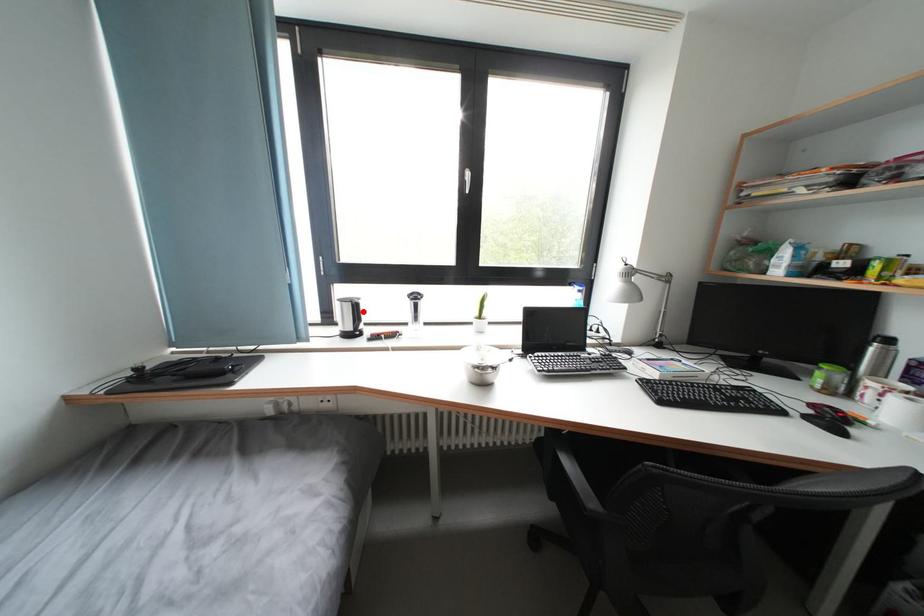
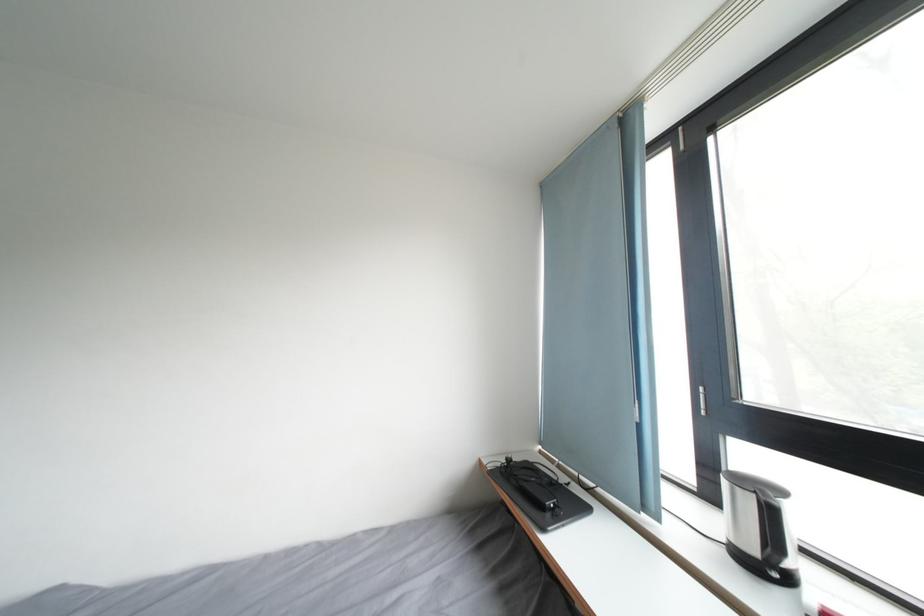
Question: I am providing you with two images of the same scene from different viewpoints. Image1 has a red point marked. In image2, the corresponding 3D location appears at what relative position? Reply with the corresponding letter.

Choices:
 (A) Closer
 (B) Farther

Answer: (A)